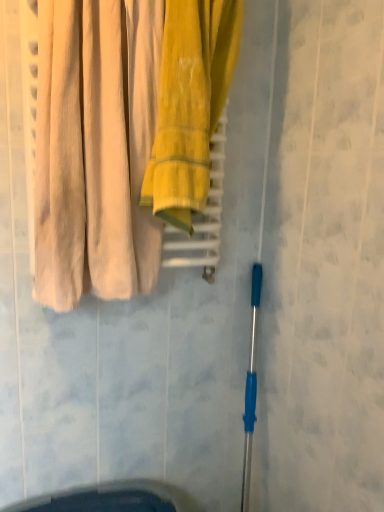
Question: Is beige cotton curtains at left bigger or smaller than yellow cotton towel at center?

Choices:
 (A) big
 (B) small

Answer: (A)

Question: Is point (92, 139) positioned closer to the camera than point (195, 52)?

Choices:
 (A) closer
 (B) farther

Answer: (B)

Question: From the image's perspective, is beige cotton curtains at left positioned above or below yellow cotton towel at center?

Choices:
 (A) below
 (B) above

Answer: (A)

Question: From their relative heights in the image, would you say yellow cotton towel at center is taller or shorter than beige cotton curtains at left?

Choices:
 (A) tall
 (B) short

Answer: (A)

Question: From a real-world perspective, is yellow cotton towel at center positioned above or below beige cotton curtains at left?

Choices:
 (A) above
 (B) below

Answer: (A)

Question: In the image, is yellow cotton towel at center positioned in front of or behind beige cotton curtains at left?

Choices:
 (A) behind
 (B) front

Answer: (A)

Question: Is yellow cotton towel at center inside the boundaries of beige cotton curtains at left, or outside?

Choices:
 (A) outside
 (B) inside

Answer: (A)